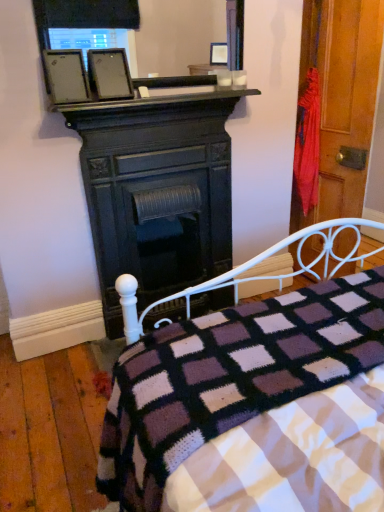
What do you see at coordinates (109, 74) in the screenshot? This screenshot has width=384, height=512. I see `matte black picture frame at upper center` at bounding box center [109, 74].

In order to face knitted woolen blanket at lower center, should I rotate leftwards or rightwards?

Turn right approximately 14.449 degrees to face it.

Image resolution: width=384 pixels, height=512 pixels. I want to click on matte black picture frame at upper center, so click(x=109, y=74).

From the picture: Can you tell me how much black matte fireplace at upper center and black glass mirror at upper center differ in facing direction?

1.42 degrees separate the facing orientations of black matte fireplace at upper center and black glass mirror at upper center.

The width and height of the screenshot is (384, 512). I want to click on mirror that is above the black matte fireplace at upper center (from a real-world perspective), so click(x=81, y=22).

Is there a large distance between black matte fireplace at upper center and black glass mirror at upper center?

No, black matte fireplace at upper center is in close proximity to black glass mirror at upper center.

Which of these two, matte black fireplace at center or knitted woolen blanket at lower center, is thinner?

matte black fireplace at center is thinner.

Is matte black fireplace at center aimed at knitted woolen blanket at lower center?

Yes, matte black fireplace at center is facing knitted woolen blanket at lower center.

Who is shorter, matte black fireplace at center or knitted woolen blanket at lower center?

Standing shorter between the two is knitted woolen blanket at lower center.

This screenshot has width=384, height=512. I want to click on bed located underneath the matte black fireplace at center (from a real-world perspective), so click(254, 407).

How many degrees apart are the facing directions of matte black fireplace at center and wooden door at right?

86.9 degrees separate the facing orientations of matte black fireplace at center and wooden door at right.

What are the coordinates of `door located above the matte black fireplace at center (from the image's perspective)` in the screenshot? It's located at (346, 100).

Considering the positions of objects matte black fireplace at center and wooden door at right in the image provided, who is more to the left, matte black fireplace at center or wooden door at right?

matte black fireplace at center is more to the left.

How different are the orientations of black glass mirror at upper center and black matte fireplace at upper center in degrees?

1.42 degrees separate the facing orientations of black glass mirror at upper center and black matte fireplace at upper center.

Is black glass mirror at upper center oriented away from black matte fireplace at upper center?

No, black glass mirror at upper center is not facing the opposite direction of black matte fireplace at upper center.

Between point (132, 3) and point (54, 110), which one is positioned behind?

The point (132, 3) is more distant.

Does matte black picture frame at upper center turn towards knitted woolen blanket at lower center?

No, matte black picture frame at upper center does not turn towards knitted woolen blanket at lower center.

How different are the orientations of matte black picture frame at upper center and knitted woolen blanket at lower center in degrees?

The facing directions of matte black picture frame at upper center and knitted woolen blanket at lower center are 175 degrees apart.

From the image's perspective, does matte black picture frame at upper center appear lower than knitted woolen blanket at lower center?

No.

Is matte black picture frame at upper center placed right next to knitted woolen blanket at lower center?

No, matte black picture frame at upper center is not touching knitted woolen blanket at lower center.

From the image's perspective, is black matte fireplace at upper center above or below matte black picture frame at upper center?

black matte fireplace at upper center is below matte black picture frame at upper center.

Between black matte fireplace at upper center and matte black picture frame at upper center, which one has smaller size?

With smaller size is matte black picture frame at upper center.

Can you confirm if black matte fireplace at upper center is shorter than matte black picture frame at upper center?

Correct, black matte fireplace at upper center is not as tall as matte black picture frame at upper center.

This screenshot has width=384, height=512. What are the coordinates of `mantle lying below the matte black picture frame at upper center (from the image's perspective)` in the screenshot? It's located at (161, 99).

From a real-world perspective, does black matte fireplace at upper center stand above knitted woolen blanket at lower center?

Yes, from a real-world perspective, black matte fireplace at upper center is on top of knitted woolen blanket at lower center.

How much distance is there between black matte fireplace at upper center and knitted woolen blanket at lower center?

black matte fireplace at upper center is 1.23 meters away from knitted woolen blanket at lower center.

Is black matte fireplace at upper center placed right next to knitted woolen blanket at lower center?

No.

In the image, is black matte fireplace at upper center on the left side or the right side of knitted woolen blanket at lower center?

Clearly, black matte fireplace at upper center is on the left of knitted woolen blanket at lower center in the image.

At what (x,y) coordinates should I click in order to perform the action: click on mirror above the black matte fireplace at upper center (from a real-world perspective). Please return your answer as a coordinate pair (x, y). Looking at the image, I should click on (81, 22).

Identify the location of bed that appears below the matte black fireplace at center (from the image's perspective). The height and width of the screenshot is (512, 384). (254, 407).

Which object lies nearer to the anchor point knitted woolen blanket at lower center, wooden door at right or black matte fireplace at upper center?

black matte fireplace at upper center lies closer to knitted woolen blanket at lower center than the other object.

Looking at the image, which one is located further to wooden door at right, matte black fireplace at center or black glass mirror at upper center?

Based on the image, black glass mirror at upper center appears to be further to wooden door at right.

Looking at the image, which one is located closer to knitted woolen blanket at lower center, black glass mirror at upper center or matte black fireplace at center?

Among the two, matte black fireplace at center is located nearer to knitted woolen blanket at lower center.

When comparing their distances from black matte fireplace at upper center, does matte black fireplace at center or black glass mirror at upper center seem closer?

black glass mirror at upper center is closer to black matte fireplace at upper center.

Estimate the real-world distances between objects in this image. Which object is further from matte black picture frame at upper center, knitted woolen blanket at lower center or black glass mirror at upper center?

The object further to matte black picture frame at upper center is knitted woolen blanket at lower center.

Which object lies nearer to the anchor point wooden door at right, black matte fireplace at upper center or knitted woolen blanket at lower center?

Among the two, black matte fireplace at upper center is located nearer to wooden door at right.

Based on their spatial positions, is black glass mirror at upper center or black matte fireplace at upper center closer to matte black fireplace at center?

black matte fireplace at upper center is positioned closer to the anchor matte black fireplace at center.

Which object lies further to the anchor point wooden door at right, black matte fireplace at upper center or black glass mirror at upper center?

black glass mirror at upper center is further to wooden door at right.

Image resolution: width=384 pixels, height=512 pixels. Find the location of `desk between black glass mirror at upper center and wooden door at right in the horizontal direction`. desk between black glass mirror at upper center and wooden door at right in the horizontal direction is located at coordinates (157, 192).

Locate an element on the screen. The width and height of the screenshot is (384, 512). desk between black glass mirror at upper center and knitted woolen blanket at lower center vertically is located at coordinates (157, 192).

The width and height of the screenshot is (384, 512). Identify the location of mirror situated between matte black picture frame at upper center and wooden door at right from left to right. (81, 22).

Where is `mantle between black glass mirror at upper center and knitted woolen blanket at lower center in the vertical direction`? The image size is (384, 512). mantle between black glass mirror at upper center and knitted woolen blanket at lower center in the vertical direction is located at coordinates (161, 99).